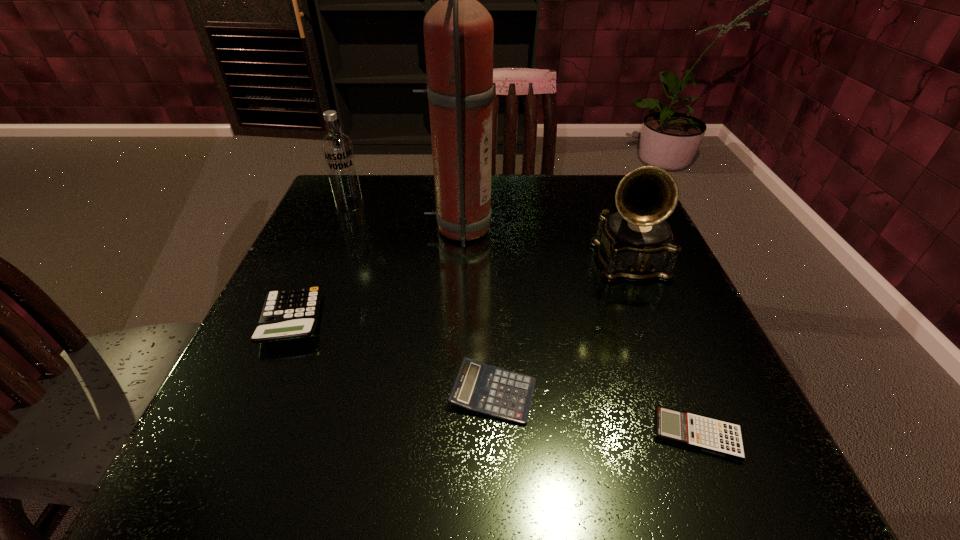
This screenshot has height=540, width=960. What are the coordinates of `vacant space located 0.310m on the horn of the phonograph record` in the screenshot? It's located at (703, 449).

Identify the location of vacant position located 0.140m on the front label of the vodka. (331, 248).

Identify the location of vacant space located on the back of the farthest calculator. (326, 242).

This screenshot has width=960, height=540. What are the coordinates of `vacant space located 0.190m on the right of the second shortest calculator` in the screenshot? It's located at (662, 393).

The image size is (960, 540). What are the coordinates of `free space located 0.400m on the left of the rightmost calculator` in the screenshot? It's located at [368, 434].

Find the location of a particular element. This screenshot has height=540, width=960. fire extinguisher present at the far edge is located at coordinates (458, 30).

Where is `vodka present at the far edge`? This screenshot has height=540, width=960. vodka present at the far edge is located at coordinates (337, 149).

Locate an element on the screen. object present at the near edge is located at coordinates (721, 438).

Where is `vodka that is at the left edge`? This screenshot has height=540, width=960. vodka that is at the left edge is located at coordinates (337, 149).

Locate an element on the screen. The image size is (960, 540). calculator that is at the left edge is located at coordinates (292, 313).